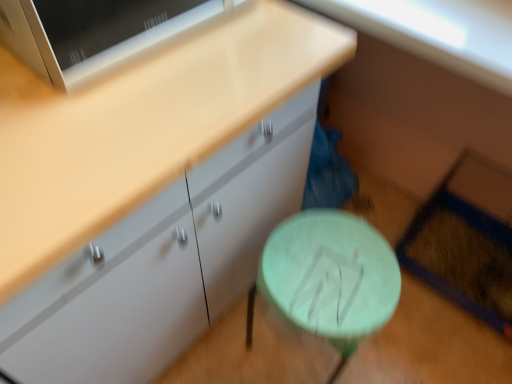
What is the approximate width of matte white cabinet at center?

matte white cabinet at center is 25.58 inches wide.

Where is `matte white cabinet at center`? The width and height of the screenshot is (512, 384). matte white cabinet at center is located at coordinates (151, 194).

What do you see at coordinates (151, 194) in the screenshot? I see `matte white cabinet at center` at bounding box center [151, 194].

What do you see at coordinates (329, 278) in the screenshot? This screenshot has height=384, width=512. I see `green matte table at lower center` at bounding box center [329, 278].

Identify the location of green matte table at lower center. (329, 278).

Identify the location of matte white cabinet at center. (151, 194).

Considering the positions of objects matte white cabinet at center and green matte table at lower center in the image provided, who is more to the left, matte white cabinet at center or green matte table at lower center?

matte white cabinet at center is more to the left.

Is matte white cabinet at center closer to camera compared to green matte table at lower center?

Yes, it is in front of green matte table at lower center.

Which is closer to the camera, (128,223) or (397,301)?

The point (128,223) is more forward.

From the image's perspective, which one is positioned higher, matte white cabinet at center or green matte table at lower center?

From the image's view, matte white cabinet at center is above.

From a real-world perspective, is matte white cabinet at center above or below green matte table at lower center?

matte white cabinet at center is situated higher than green matte table at lower center in the real world.

Considering the sizes of objects matte white cabinet at center and green matte table at lower center in the image provided, who is thinner, matte white cabinet at center or green matte table at lower center?

green matte table at lower center is thinner.

Considering the sizes of objects matte white cabinet at center and green matte table at lower center in the image provided, who is shorter, matte white cabinet at center or green matte table at lower center?

green matte table at lower center is shorter.

Based on the photo, does matte white cabinet at center have a larger size compared to green matte table at lower center?

Indeed, matte white cabinet at center has a larger size compared to green matte table at lower center.

Would you say matte white cabinet at center is outside green matte table at lower center?

Indeed, matte white cabinet at center is completely outside green matte table at lower center.

Is matte white cabinet at center next to green matte table at lower center?

No.

Could you tell me if matte white cabinet at center is turned towards green matte table at lower center?

Yes, matte white cabinet at center is turned towards green matte table at lower center.

How different are the orientations of matte white cabinet at center and green matte table at lower center in degrees?

There is a 0.000162-degree angle between the facing directions of matte white cabinet at center and green matte table at lower center.

You are a GUI agent. You are given a task and a screenshot of the screen. Output one action in this format:
    pyautogui.click(x=<x>, y=<y>)
    Task: Click on the cabinetry in front of the green matte table at lower center
    The width and height of the screenshot is (512, 384).
    Given the screenshot: What is the action you would take?
    pyautogui.click(x=151, y=194)

Is green matte table at lower center at the left side of matte white cabinet at center?

No.

Does green matte table at lower center lie in front of matte white cabinet at center?

No, green matte table at lower center is further to the viewer.

Looking at this image, which point is more forward, (325, 222) or (28, 268)?

Point (28, 268)

From the image's perspective, would you say green matte table at lower center is shown under matte white cabinet at center?

Indeed, from the image's perspective, green matte table at lower center is shown beneath matte white cabinet at center.

From a real-world perspective, is green matte table at lower center physically above matte white cabinet at center?

Actually, green matte table at lower center is physically below matte white cabinet at center in the real world.

Can you confirm if green matte table at lower center is wider than matte white cabinet at center?

No, green matte table at lower center is not wider than matte white cabinet at center.

Does green matte table at lower center have a greater height compared to matte white cabinet at center?

No.

Can you confirm if green matte table at lower center is bigger than matte white cabinet at center?

No.

Is matte white cabinet at center completely or partially inside green matte table at lower center?

No, matte white cabinet at center is not surrounded by green matte table at lower center.

Is green matte table at lower center far from matte white cabinet at center?

No.

Is green matte table at lower center facing towards matte white cabinet at center?

No, green matte table at lower center does not turn towards matte white cabinet at center.

Can you tell me how much green matte table at lower center and matte white cabinet at center differ in facing direction?

0.000162 degrees separate the facing orientations of green matte table at lower center and matte white cabinet at center.

How far apart are green matte table at lower center and matte white cabinet at center?

They are 12.42 inches apart.

Where is `cabinetry above the green matte table at lower center (from the image's perspective)`? Image resolution: width=512 pixels, height=384 pixels. cabinetry above the green matte table at lower center (from the image's perspective) is located at coordinates (151, 194).

Where is `cabinetry located above the green matte table at lower center (from the image's perspective)`? cabinetry located above the green matte table at lower center (from the image's perspective) is located at coordinates (151, 194).

The width and height of the screenshot is (512, 384). I want to click on cabinetry on the left of green matte table at lower center, so click(151, 194).